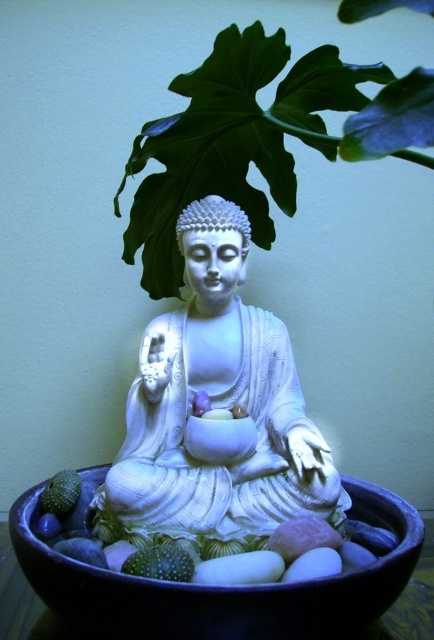
Question: Can you confirm if green leafy plant at upper center is positioned below green speckled fruit at lower center?

Choices:
 (A) no
 (B) yes

Answer: (A)

Question: Considering the real-world distances, which object is farthest from the green matte avocado at lower left?

Choices:
 (A) green speckled fruit at lower center
 (B) white glossy statue at center

Answer: (B)

Question: Can you confirm if green leafy plant at upper center is positioned to the right of black ceramic bowl at center?

Choices:
 (A) no
 (B) yes

Answer: (B)

Question: Which of the following is the closest to the observer?

Choices:
 (A) white glossy statue at center
 (B) black ceramic bowl at center
 (C) green leafy plant at upper center

Answer: (C)

Question: Estimate the real-world distances between objects in this image. Which object is farther from the black ceramic bowl at center?

Choices:
 (A) green matte avocado at lower left
 (B) green speckled fruit at lower center
 (C) green leafy plant at upper center
 (D) white glossy statue at center

Answer: (C)

Question: Can you confirm if green leafy plant at upper center is positioned below green speckled fruit at lower center?

Choices:
 (A) no
 (B) yes

Answer: (A)